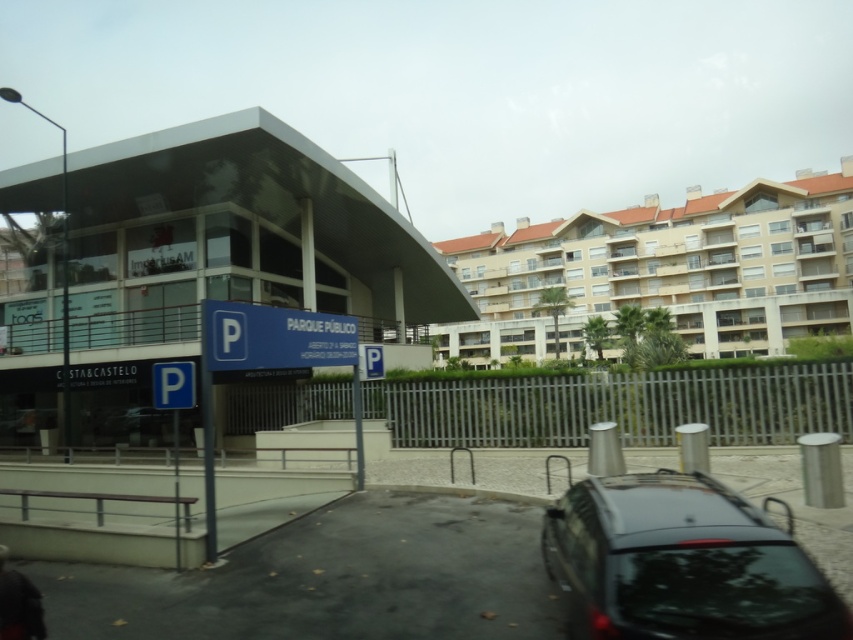
You are a delivery driver approaching the transparent glass building at center and the blue plastic parking sign at center. Which object will you see first as you drive towards them?

The transparent glass building at center will be seen first because the blue plastic parking sign at center is positioned behind it, making the building the first visible object in your path.

You are standing at the point with coordinates point (x=225, y=256). Which object in the scene is directly beneath you?

The point (x=225, y=256) is on transparent glass building at center, so the transparent glass building at center is directly beneath you.